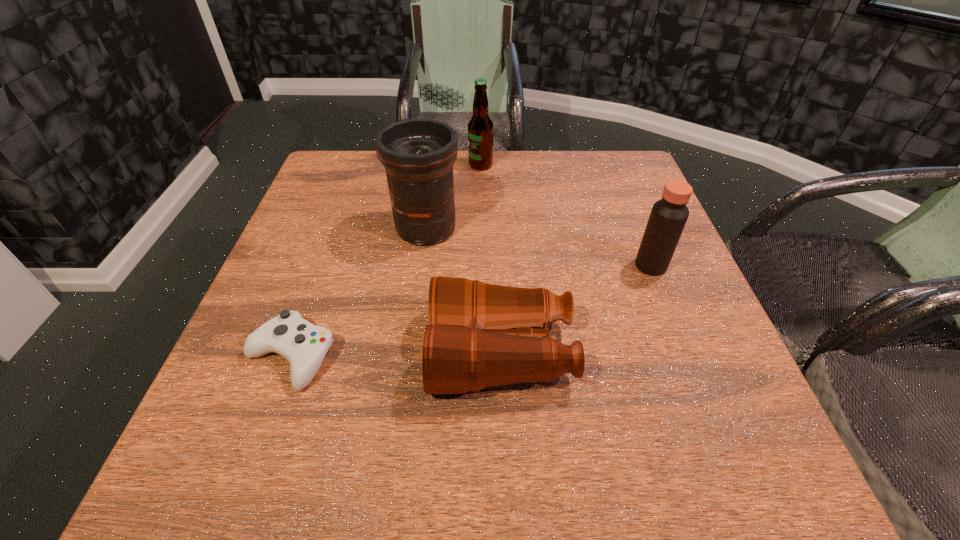
The height and width of the screenshot is (540, 960). Identify the location of beer bottle. (480, 126).

This screenshot has width=960, height=540. Find the location of `the second farthest object`. the second farthest object is located at coordinates (418, 154).

Where is `the third tallest object`? the third tallest object is located at coordinates (668, 216).

Identify the location of the rightmost object. (668, 216).

Where is `the fourth tallest object`? the fourth tallest object is located at coordinates (480, 335).

I want to click on control, so click(304, 345).

Image resolution: width=960 pixels, height=540 pixels. Find the location of `the leftmost object`. the leftmost object is located at coordinates (304, 345).

You are a GUI agent. You are given a task and a screenshot of the screen. Output one action in this format:
    pyautogui.click(x=<x>, y=<y>)
    Task: Click on the vacant region located on the label of the farthest object
    The image size is (960, 540).
    Given the screenshot: What is the action you would take?
    pyautogui.click(x=401, y=165)

Find the location of `vacant space located 0.130m on the label of the farthest object`. vacant space located 0.130m on the label of the farthest object is located at coordinates (422, 165).

Locate an element on the screen. The image size is (960, 540). vacant space located 0.090m on the label of the farthest object is located at coordinates 437,165.